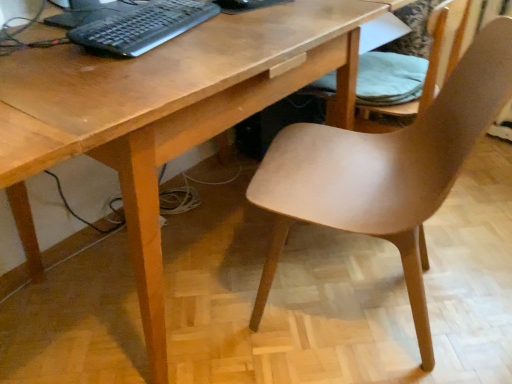
At what (x,y) coordinates should I click in order to perform the action: click on blank space to the left of matte wood chair at center, arranged as the second chair when viewed from the back. Please return your answer as a coordinate pair (x, y). Image resolution: width=512 pixels, height=384 pixels. Looking at the image, I should click on (205, 288).